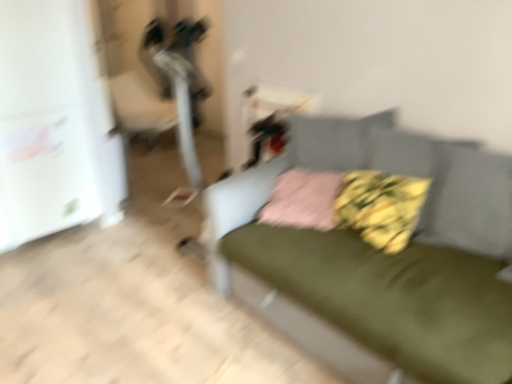
Question: Is fluffy yellow pillow at center, which is the 2th pillow in left-to-right order, wider or thinner than green fabric couch at center?

Choices:
 (A) wide
 (B) thin

Answer: (B)

Question: Which is correct: fluffy yellow pillow at center, which is the 2th pillow in left-to-right order, is inside green fabric couch at center, or outside of it?

Choices:
 (A) inside
 (B) outside

Answer: (A)

Question: Based on their relative distances, which object is farther from the fluffy yellow pillow at center, which is the 2th pillow in left-to-right order?

Choices:
 (A) pink fabric pillow at center, acting as the first pillow starting from the left
 (B) green fabric couch at center

Answer: (B)

Question: Which is farther from the pink fabric pillow at center, acting as the first pillow starting from the left?

Choices:
 (A) fluffy yellow pillow at center, which is the first pillow in right-to-left order
 (B) green fabric couch at center

Answer: (B)